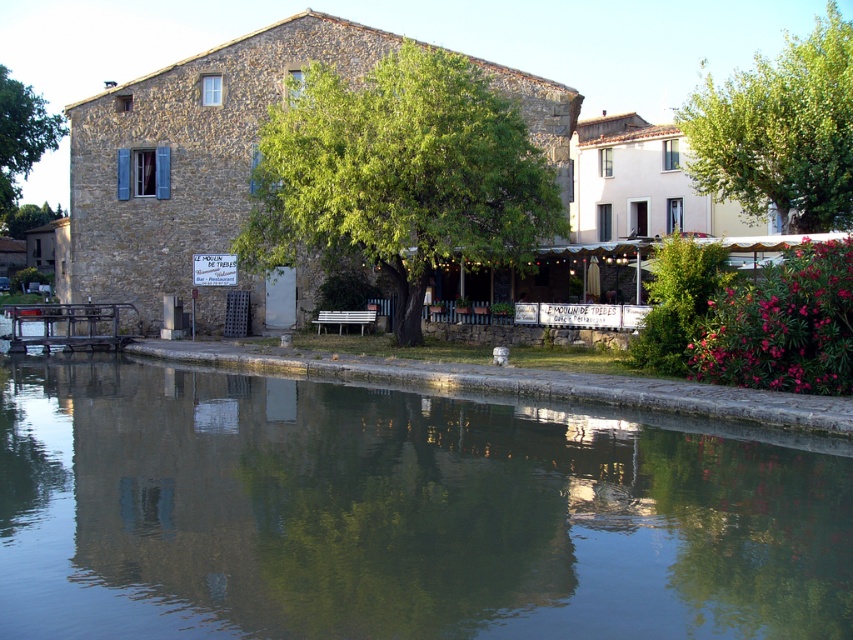
Does green leafy tree at upper right appear under green leafy tree at left?

No.

Is point (780, 93) more distant than point (28, 138)?

No, it is not.

Locate an element on the screen. green leafy tree at upper right is located at coordinates (780, 132).

Who is higher up, green reflective water at center or green leafy tree at left?

green leafy tree at left

Which is in front, point (456, 413) or point (26, 128)?

Positioned in front is point (456, 413).

Locate an element on the screen. This screenshot has width=853, height=640. green reflective water at center is located at coordinates (398, 513).

Locate an element on the screen. This screenshot has width=853, height=640. green reflective water at center is located at coordinates (398, 513).

Does green leafy tree at center lie in front of green leafy tree at left?

Yes, green leafy tree at center is closer to the viewer.

Who is taller, green leafy tree at center or green leafy tree at left?

Standing taller between the two is green leafy tree at center.

Which is in front, point (376, 108) or point (18, 172)?

Point (376, 108)

Identify the location of green leafy tree at center. Image resolution: width=853 pixels, height=640 pixels. (399, 176).